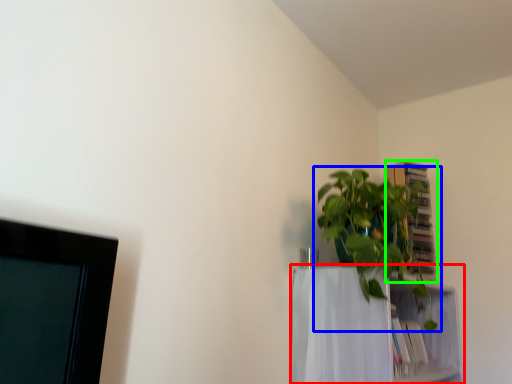
Question: Estimate the real-world distances between objects in this image. Which object is farther from shelf (highlighted by a red box), houseplant (highlighted by a blue box) or cabinet (highlighted by a green box)?

Choices:
 (A) houseplant
 (B) cabinet

Answer: (B)